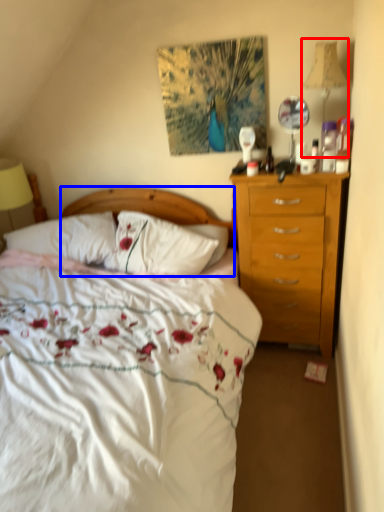
Question: Among these objects, which one is farthest to the camera, bedside lamp (highlighted by a red box) or headboard (highlighted by a blue box)?

Choices:
 (A) bedside lamp
 (B) headboard

Answer: (B)